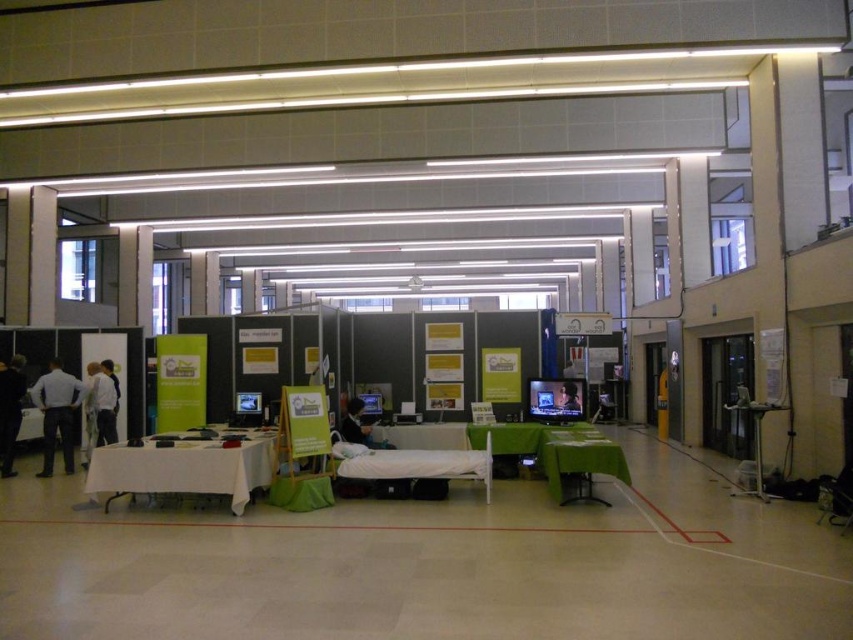
Is white fabric bed at center above green fabric table at center?

Indeed, white fabric bed at center is positioned over green fabric table at center.

Does point (451, 477) come behind point (606, 444)?

Yes.

The image size is (853, 640). I want to click on white fabric bed at center, so click(x=421, y=465).

You are a GUI agent. You are given a task and a screenshot of the screen. Output one action in this format:
    pyautogui.click(x=<x>, y=<y>)
    Task: Click on the white fabric bed at center
    Image resolution: width=853 pixels, height=640 pixels.
    Given the screenshot: What is the action you would take?
    pyautogui.click(x=421, y=465)

Can you confirm if green fabric table at center is taller than dark gray suit at left?

No, green fabric table at center is not taller than dark gray suit at left.

Is green fabric table at center bigger than dark gray suit at left?

Incorrect, green fabric table at center is not larger than dark gray suit at left.

This screenshot has width=853, height=640. Find the location of `green fabric table at center`. green fabric table at center is located at coordinates (582, 460).

Locate an element on the screen. Image resolution: width=853 pixels, height=640 pixels. green fabric table at center is located at coordinates (582, 460).

Is point (346, 474) in front of point (549, 392)?

Yes, point (346, 474) is in front of point (549, 392).

Does point (422, 460) come farther from viewer compared to point (527, 412)?

No, (422, 460) is closer to viewer.

Image resolution: width=853 pixels, height=640 pixels. I want to click on white fabric bed at center, so click(x=421, y=465).